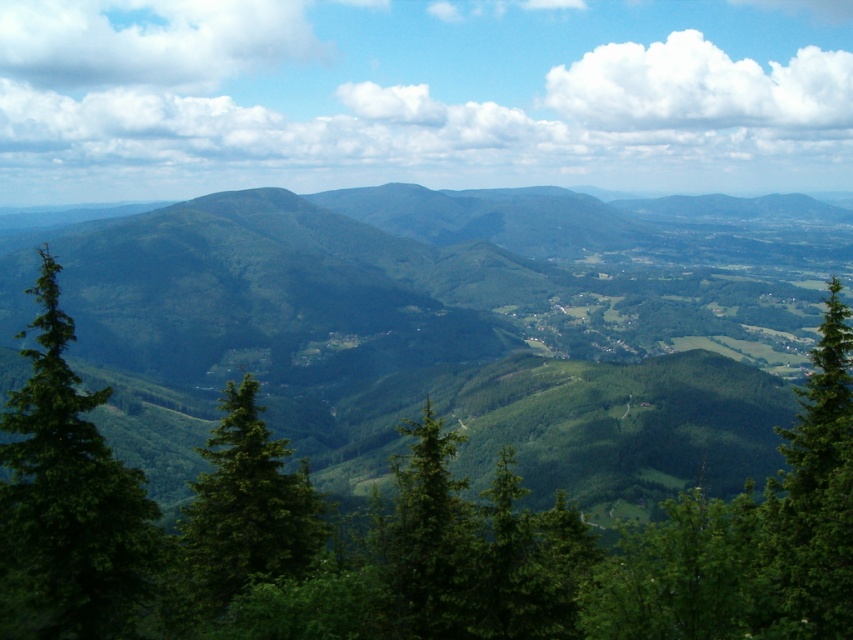
You are an environmental scientist analyzing the mountain landscape. You observe the green matte forest at center and the green matte tree at center. Which of these two features is positioned higher in the image?

The green matte forest at center is located above the green matte tree at center, so it is positioned higher in the image.

You are an environmental researcher studying the spatial distribution of vegetation in the mountainous area. You observe the green matte forest at center and the green matte tree at left. Which of these two objects is located to the right of the other?

The green matte forest at center is positioned on the left side of the green matte tree at left, meaning the green matte tree at left is to the right of the green matte forest at center.